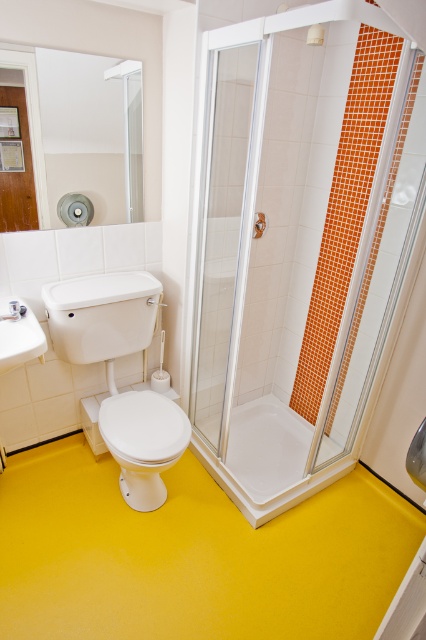
Question: Can you confirm if transparent glass shower door at center is positioned below white glossy toilet bowl at lower left?

Choices:
 (A) no
 (B) yes

Answer: (A)

Question: Observing the image, what is the correct spatial positioning of transparent glass shower door at center in reference to white glossy bathtub at center?

Choices:
 (A) below
 (B) above

Answer: (B)

Question: Which object appears closest to the camera in this image?

Choices:
 (A) clear glass shower door at center
 (B) white glossy bathtub at center

Answer: (A)

Question: Does white glossy sink at lower left come behind white glossy shower at upper center?

Choices:
 (A) no
 (B) yes

Answer: (B)

Question: Which of the following is the closest to the observer?

Choices:
 (A) white glossy shower at upper center
 (B) white glossy sink at lower left
 (C) transparent glass shower door at center

Answer: (C)

Question: Estimate the real-world distances between objects in this image. Which object is farther from the white glossy toilet bowl at lower left?

Choices:
 (A) white glossy bathtub at center
 (B) transparent glass shower door at center
 (C) clear glass shower door at center

Answer: (B)